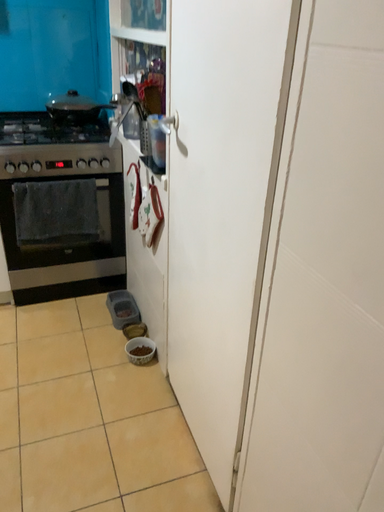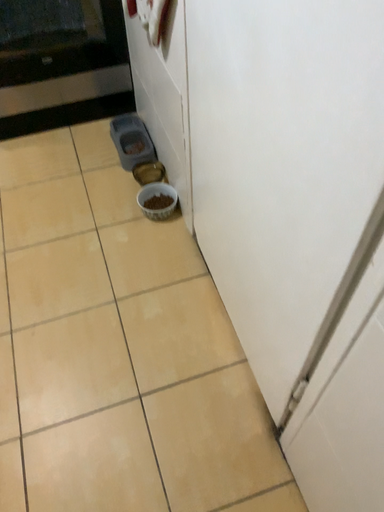
Question: How did the camera likely rotate when shooting the video?

Choices:
 (A) rotated downward
 (B) rotated upward

Answer: (A)